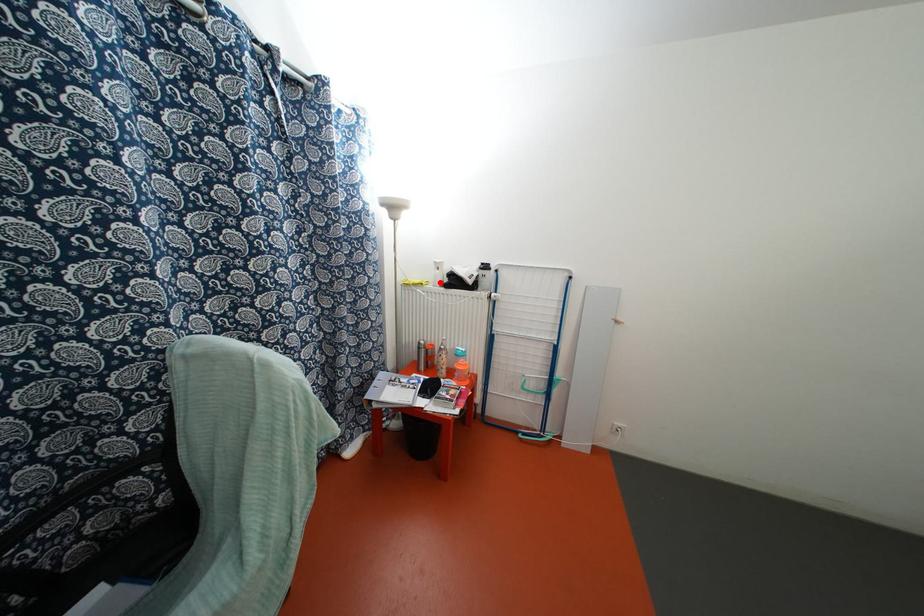
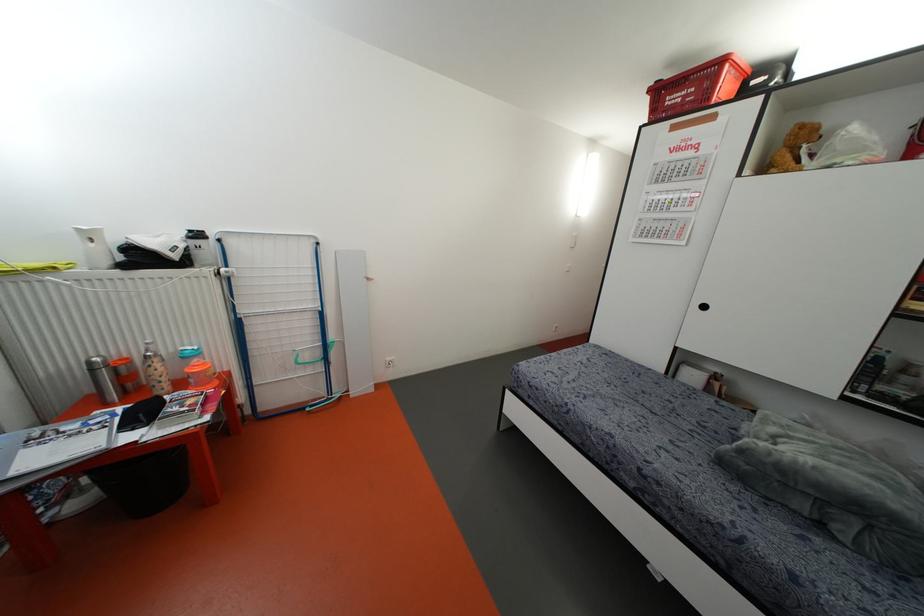
In the second image, find the point that corresponds to the highlighted location in the first image.

(107, 262)